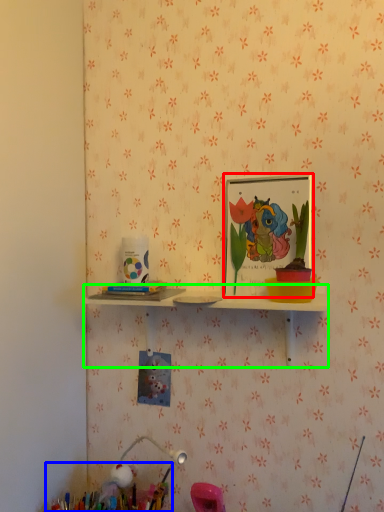
Question: Which object is the closest to the picture frame (highlighted by a red box)? Choose among these: collection (highlighted by a blue box) or shelf (highlighted by a green box).

Choices:
 (A) collection
 (B) shelf

Answer: (B)